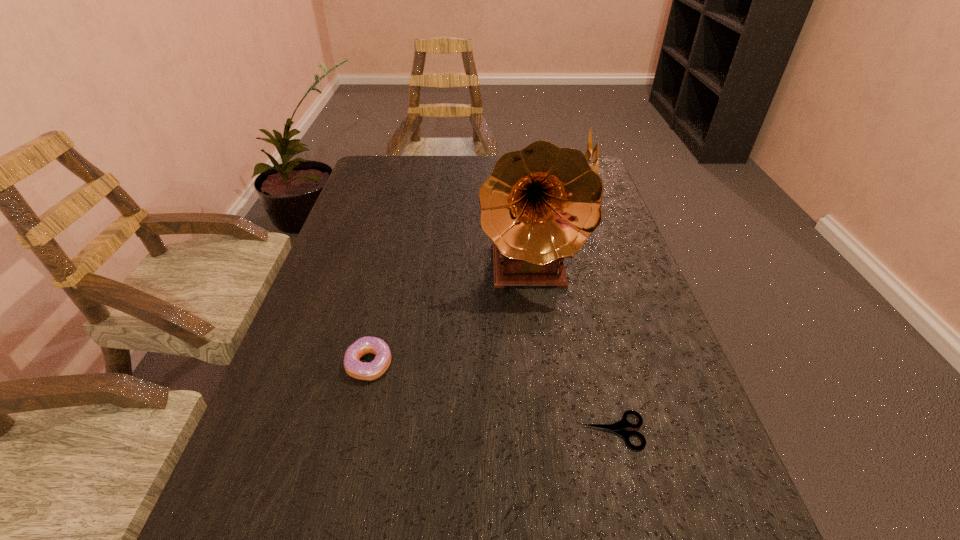
This screenshot has height=540, width=960. Identify the location of vacant space at the far edge. (457, 167).

The image size is (960, 540). What are the coordinates of `free space at the left edge of the desktop` in the screenshot? It's located at click(367, 218).

You are a GUI agent. You are given a task and a screenshot of the screen. Output one action in this format:
    pyautogui.click(x=<x>, y=<y>)
    Task: Click on the free location at the right edge
    
    Given the screenshot: What is the action you would take?
    pyautogui.click(x=637, y=334)

Locate an element on the screen. The height and width of the screenshot is (540, 960). free region at the far left corner is located at coordinates (365, 180).

Image resolution: width=960 pixels, height=540 pixels. Identify the location of empty space that is in between the leftmost object and the second farthest object. (449, 317).

Image resolution: width=960 pixels, height=540 pixels. Find the location of `free space that is in between the farthest object and the nearest object`. free space that is in between the farthest object and the nearest object is located at coordinates (601, 308).

Image resolution: width=960 pixels, height=540 pixels. Identify the location of empty space that is in between the shortest object and the second farthest object. (571, 350).

Locate an element on the screen. This screenshot has width=960, height=540. free space between the phonograph_record and the leftmost object is located at coordinates (449, 317).

Find the location of `empty space between the third tallest object and the shortest object`. empty space between the third tallest object and the shortest object is located at coordinates (492, 397).

Where is `empty space between the doughnut and the rightmost object`? The image size is (960, 540). empty space between the doughnut and the rightmost object is located at coordinates (479, 275).